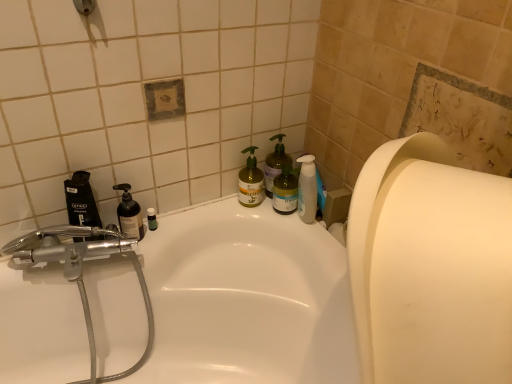
This screenshot has width=512, height=384. Identify the location of empty space that is to the right of transparent plastic bottle at left. (197, 220).